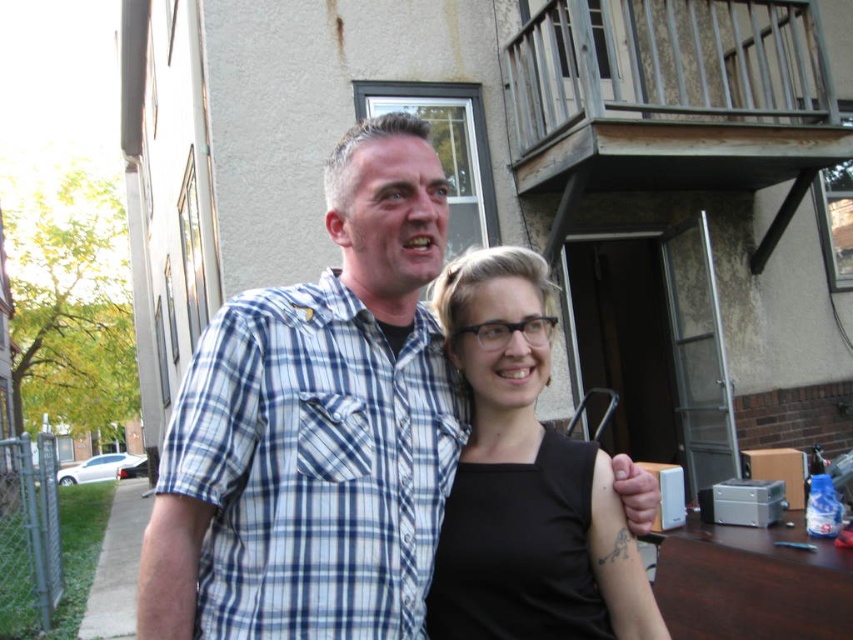
Question: In this image, where is blue plaid shirt at center located relative to black matte tank top at center?

Choices:
 (A) above
 (B) below

Answer: (A)

Question: Does blue plaid shirt at center have a greater width compared to black matte tank top at center?

Choices:
 (A) no
 (B) yes

Answer: (B)

Question: Which point is farther to the camera?

Choices:
 (A) black matte tank top at center
 (B) blue plaid shirt at center

Answer: (A)

Question: Which of the following is the farthest from the observer?

Choices:
 (A) blue plaid shirt at center
 (B) black matte tank top at center

Answer: (B)

Question: Can you confirm if blue plaid shirt at center is positioned to the right of black matte tank top at center?

Choices:
 (A) yes
 (B) no

Answer: (B)

Question: Among these objects, which one is nearest to the camera?

Choices:
 (A) blue plaid shirt at center
 (B) black matte tank top at center

Answer: (A)